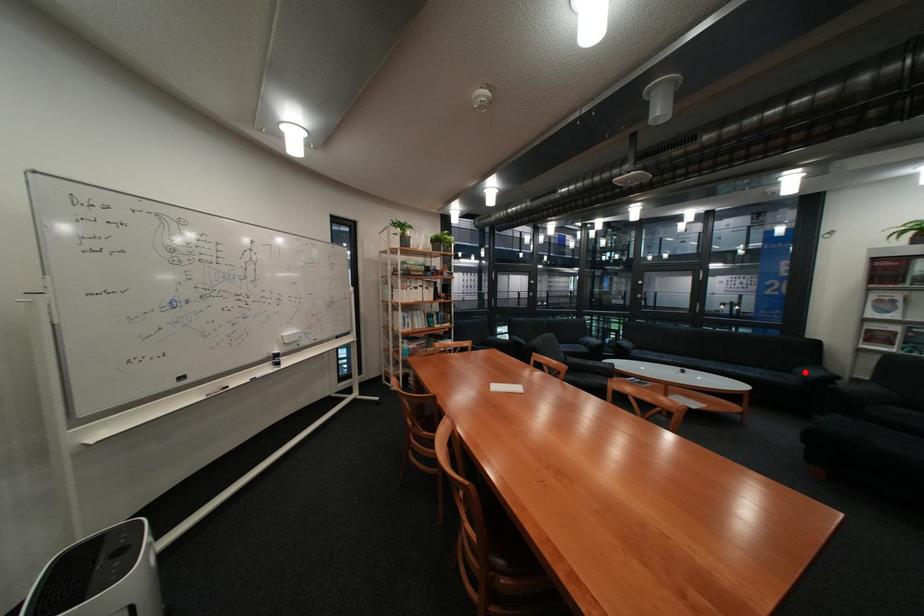
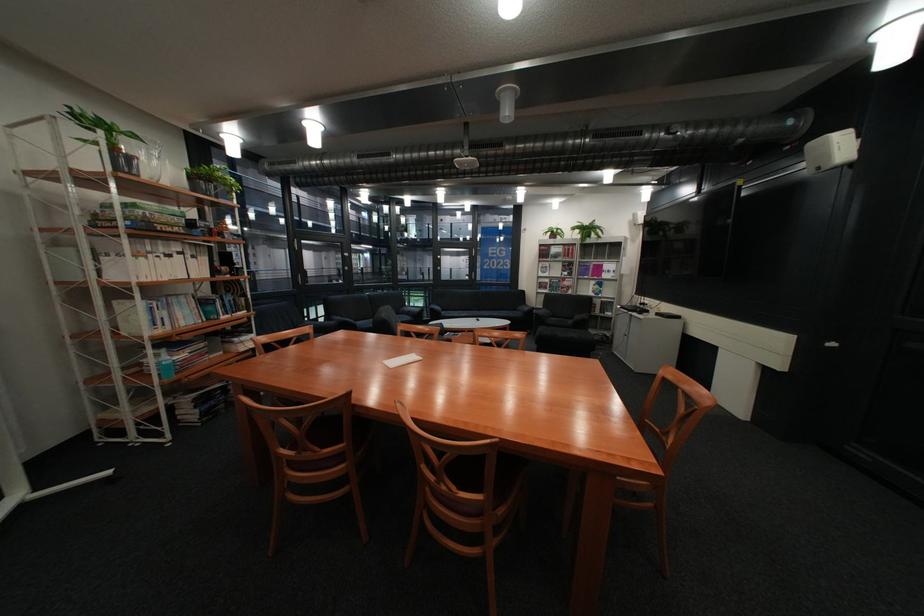
Question: I am providing you with two images of the same scene from different viewpoints. Image1 has a red point marked. In image2, the corresponding 3D location appears at what relative position? Reply with the corresponding letter.

Choices:
 (A) Closer
 (B) Farther

Answer: (A)